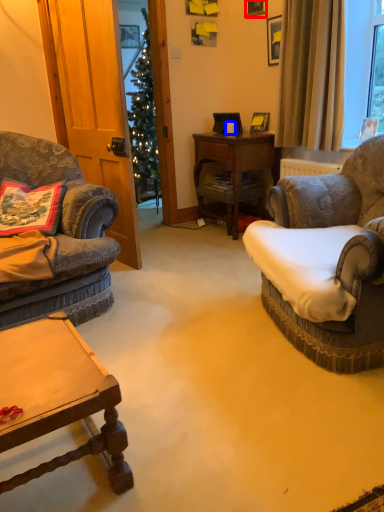
Question: Among these objects, which one is nearest to the camera, picture frame (highlighted by a red box) or coffee cup (highlighted by a blue box)?

Choices:
 (A) picture frame
 (B) coffee cup

Answer: (A)